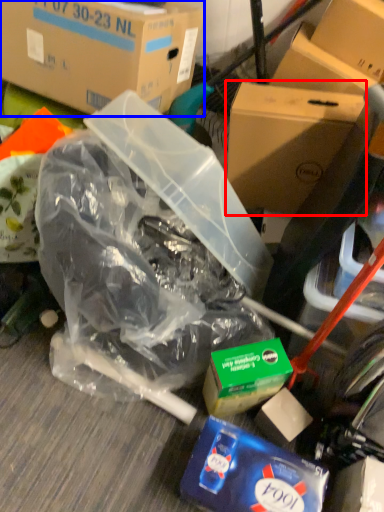
Question: Which point is closer to the camera, box (highlighted by a red box) or box (highlighted by a blue box)?

Choices:
 (A) box
 (B) box

Answer: (B)